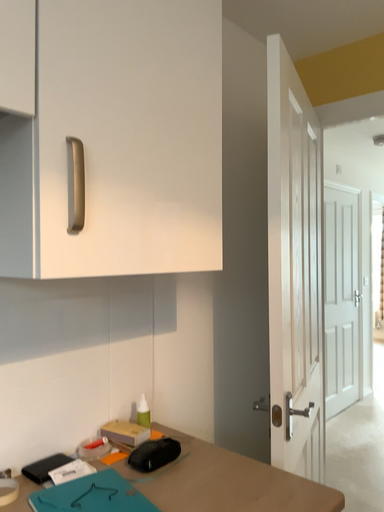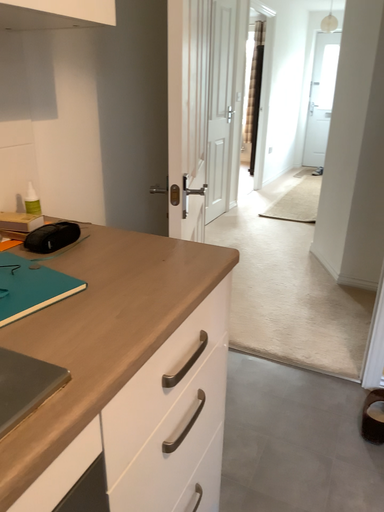
Question: Which way did the camera rotate in the video?

Choices:
 (A) rotated left
 (B) rotated right

Answer: (B)